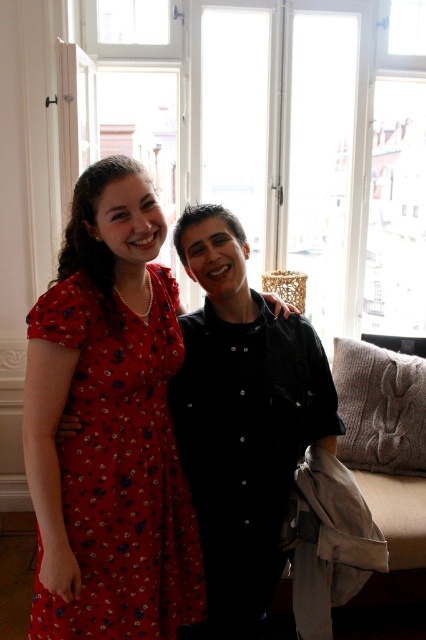
You are a photographer setting up a shoot in this room. You want to ensure both the transparent glass window at upper center and the floral print fabric dress at left are visible in the frame. Given their sizes, which object should you prioritize positioning closer to the camera to maintain clarity?

The transparent glass window at upper center is bigger than the floral print fabric dress at left. To maintain clarity, prioritize positioning the floral print fabric dress at left closer to the camera since it is smaller and requires less space to be clearly visible.

You are standing in the room and want to take a photo of the floral print fabric dress at left. Where should you position yourself to capture the dress in the frame?

The floral print fabric dress at left is located at point (120, 468), so you should position yourself facing that coordinate to capture it in the frame.